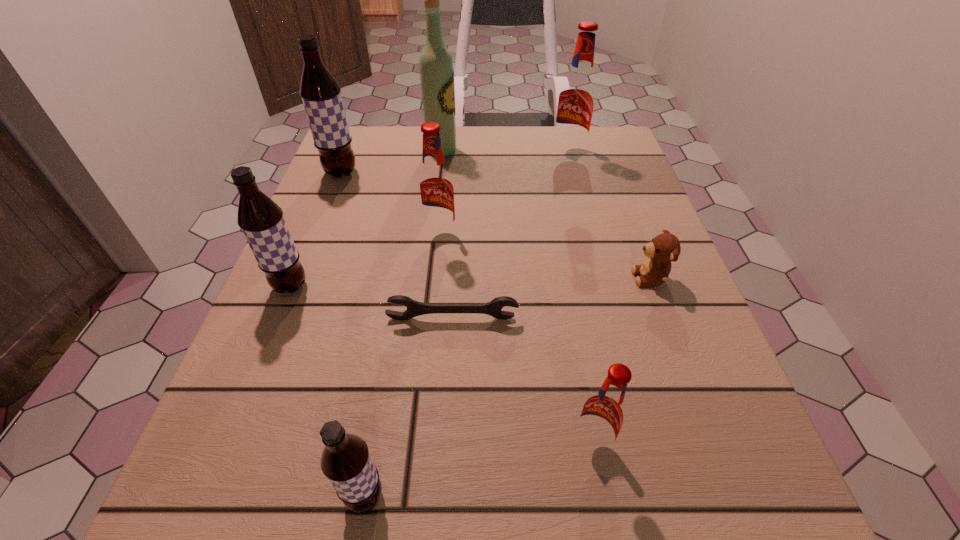
Locate an element on the screen. This screenshot has width=960, height=540. vacant space located 0.090m on the right of the fourth nearest root beer is located at coordinates (501, 237).

You are a GUI agent. You are given a task and a screenshot of the screen. Output one action in this format:
    pyautogui.click(x=<x>, y=<y>)
    Task: Click on the vacant space located on the right of the third nearest root beer
    This screenshot has width=960, height=540.
    Given the screenshot: What is the action you would take?
    pyautogui.click(x=409, y=286)

You are a GUI agent. You are given a task and a screenshot of the screen. Output one action in this format:
    pyautogui.click(x=<x>, y=<y>)
    Task: Click on the free space located 0.170m on the right of the second root beer from right to left
    The width and height of the screenshot is (960, 540).
    Given the screenshot: What is the action you would take?
    pyautogui.click(x=736, y=445)

You are a GUI agent. You are given a task and a screenshot of the screen. Output one action in this format:
    pyautogui.click(x=<x>, y=<y>)
    Task: Click on the free space located 0.070m on the back of the nearest brown root beer
    The width and height of the screenshot is (960, 540).
    Given the screenshot: What is the action you would take?
    pyautogui.click(x=377, y=423)

You are a GUI agent. You are given a task and a screenshot of the screen. Output one action in this format:
    pyautogui.click(x=<x>, y=<y>)
    Task: Click on the free space located on the face of the teddy bear
    The height and width of the screenshot is (540, 960).
    Given the screenshot: What is the action you would take?
    pyautogui.click(x=605, y=278)

The width and height of the screenshot is (960, 540). I want to click on free point located 0.090m on the face of the teddy bear, so click(584, 278).

Where is `vacant space located 0.140m on the face of the teddy bear`? This screenshot has height=540, width=960. vacant space located 0.140m on the face of the teddy bear is located at coordinates (556, 278).

I want to click on vacant space located on the open ends of the shortest object, so click(442, 517).

Identify the location of wine bottle that is at the far edge. This screenshot has width=960, height=540. (436, 66).

Identify the location of object that is at the near edge. (346, 462).